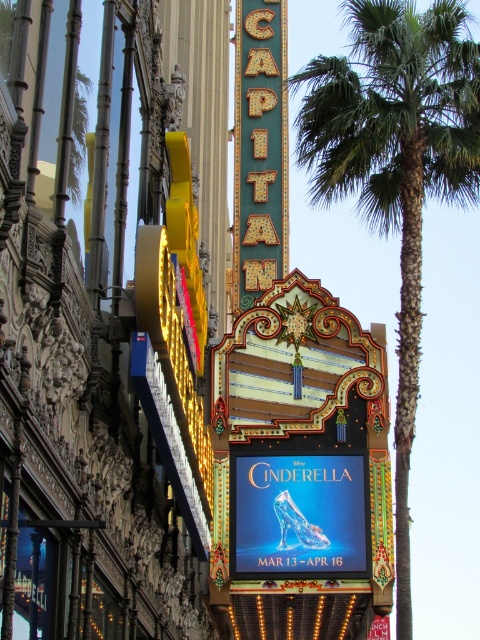
Question: Which object appears farthest from the camera in this image?

Choices:
 (A) gold metallic sign at center
 (B) green leafy palm tree at center
 (C) neon yellow sign at center

Answer: (A)

Question: Which object is the closest to the green leafy palm tree at center?

Choices:
 (A) neon yellow sign at center
 (B) gold metallic sign at center

Answer: (B)

Question: Is green leafy palm tree at center to the right of neon yellow sign at center from the viewer's perspective?

Choices:
 (A) yes
 (B) no

Answer: (A)

Question: Observing the image, what is the correct spatial positioning of green leafy palm tree at center in reference to neon yellow sign at center?

Choices:
 (A) right
 (B) left

Answer: (A)

Question: Can you confirm if gold metallic sign at center is bigger than neon yellow sign at center?

Choices:
 (A) no
 (B) yes

Answer: (B)

Question: Considering the real-world distances, which object is closest to the green leafy palm tree at center?

Choices:
 (A) gold metallic sign at center
 (B) neon yellow sign at center

Answer: (A)